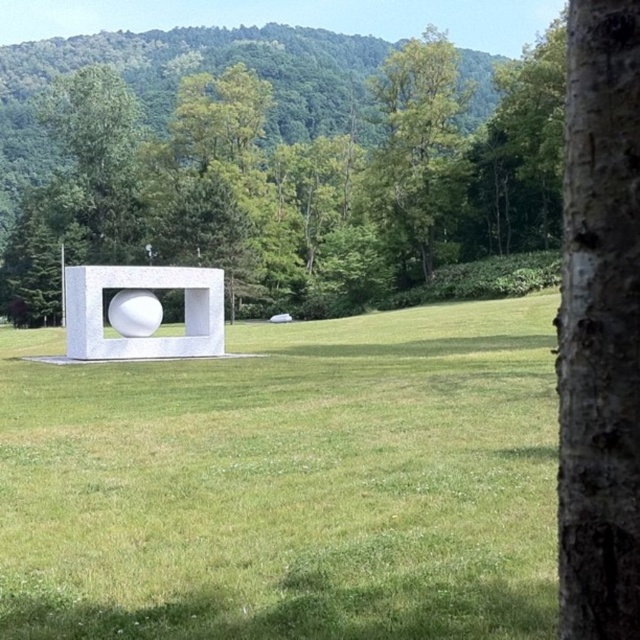
Question: Does green grass at center appear on the left side of smooth bark tree at center?

Choices:
 (A) no
 (B) yes

Answer: (B)

Question: Is green grass at center positioned at the back of green leafy tree at upper center?

Choices:
 (A) no
 (B) yes

Answer: (A)

Question: Does bark textured tree trunk at right lie in front of green leafy tree at upper center?

Choices:
 (A) yes
 (B) no

Answer: (A)

Question: Which point is closer to the camera taking this photo?

Choices:
 (A) (625, 362)
 (B) (417, 211)
 (C) (49, 579)
 (D) (436, 221)

Answer: (A)

Question: Among these objects, which one is nearest to the camera?

Choices:
 (A) green grass at center
 (B) smooth bark tree at center
 (C) bark textured tree trunk at right

Answer: (C)

Question: Which point is closer to the camera?

Choices:
 (A) green grass at center
 (B) smooth bark tree at center

Answer: (A)